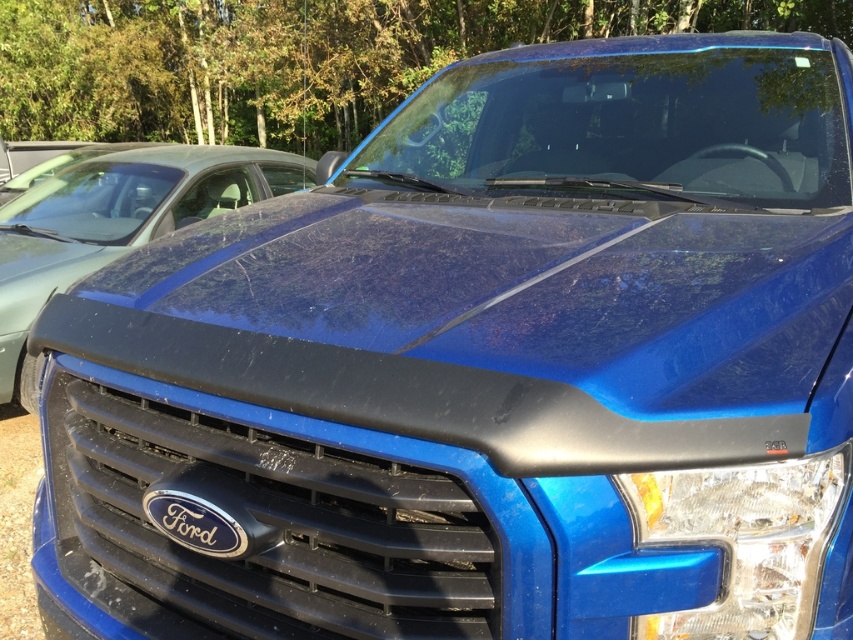
Is clear plastic headlight at lower right wider than black glossy ford emblem at center?

Yes.

Is clear plastic headlight at lower right bigger than black glossy ford emblem at center?

Yes.

Is point (747, 625) positioned in front of point (201, 550)?

Yes, point (747, 625) is closer to viewer.

Where is `clear plastic headlight at lower right`? This screenshot has height=640, width=853. clear plastic headlight at lower right is located at coordinates (744, 540).

Does matte black hood at center have a larger size compared to black glossy ford emblem at center?

Indeed, matte black hood at center has a larger size compared to black glossy ford emblem at center.

Who is more distant from viewer, [119,156] or [164,531]?

The point [119,156] is more distant.

Does point (151, 163) come closer to viewer compared to point (218, 513)?

No, it is not.

At what (x,y) coordinates should I click in order to perform the action: click on matte black hood at center. Please return your answer as a coordinate pair (x, y). This screenshot has height=640, width=853. Looking at the image, I should click on (115, 225).

Between matte black hood at center and clear plastic headlight at lower right, which one appears on the right side from the viewer's perspective?

clear plastic headlight at lower right is more to the right.

I want to click on matte black hood at center, so click(115, 225).

Measure the distance between point (x=59, y=253) and camera.

A distance of 5.01 meters exists between point (x=59, y=253) and camera.

You are a GUI agent. You are given a task and a screenshot of the screen. Output one action in this format:
    pyautogui.click(x=<x>, y=<y>)
    Task: Click on the matte black hood at center
    
    Given the screenshot: What is the action you would take?
    pyautogui.click(x=115, y=225)